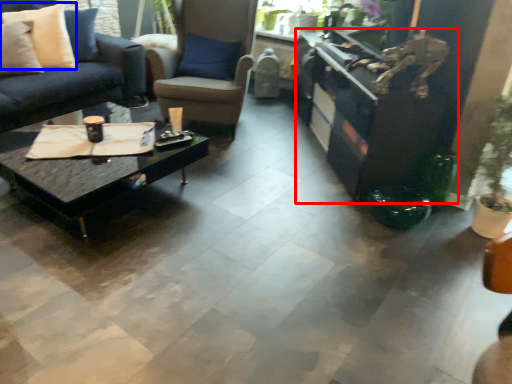
Question: Which point is closer to the camera, entertainment center (highlighted by a red box) or pillow (highlighted by a blue box)?

Choices:
 (A) entertainment center
 (B) pillow

Answer: (A)